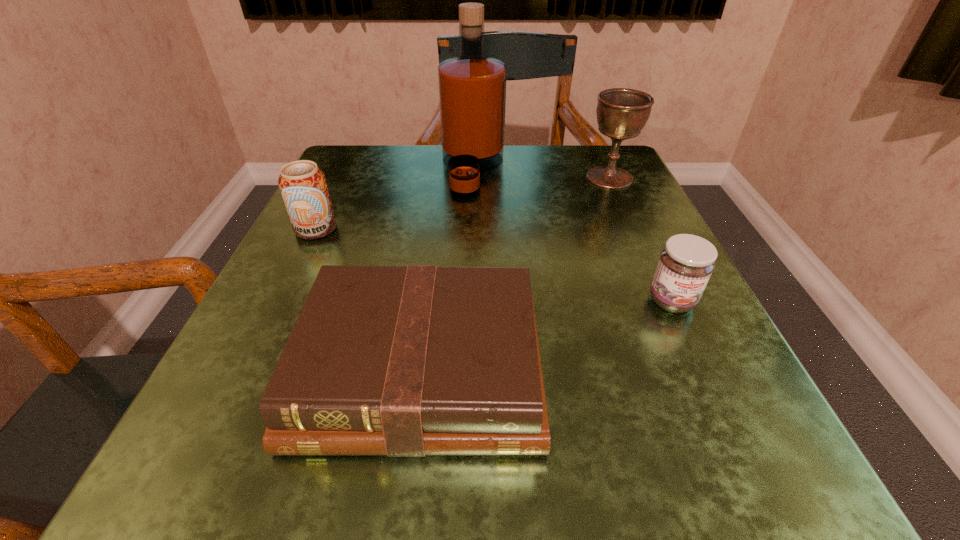
Find the location of a particular element. This screenshot has width=960, height=540. liquor present at the far edge is located at coordinates (472, 88).

Find the location of a particular element. This screenshot has height=540, width=960. chalice located at the far edge is located at coordinates (621, 113).

At what (x,y) coordinates should I click in order to perform the action: click on object at the near edge. Please return your answer as a coordinate pair (x, y). Looking at the image, I should click on (406, 361).

Locate an element on the screen. beer can that is at the left edge is located at coordinates (303, 186).

The width and height of the screenshot is (960, 540). I want to click on Bible present at the left edge, so click(406, 361).

Where is `chalice at the right edge`? chalice at the right edge is located at coordinates (621, 113).

Where is `jam that is at the right edge`? This screenshot has width=960, height=540. jam that is at the right edge is located at coordinates (686, 263).

Where is `object at the near left corner`? object at the near left corner is located at coordinates (406, 361).

Identify the location of object that is positioned at the far right corner. (621, 113).

I want to click on vacant region at the far edge of the desktop, so click(430, 150).